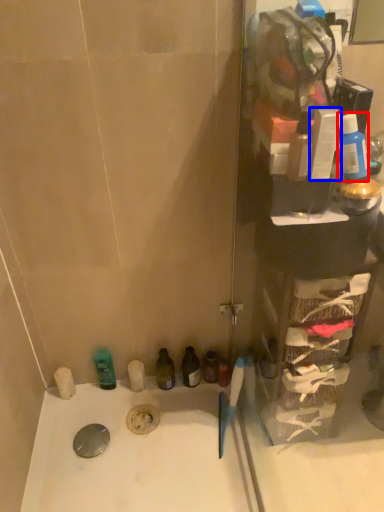
Question: Which object appears closest to the camera in this image, mouthwash (highlighted by a red box) or toiletry (highlighted by a blue box)?

Choices:
 (A) mouthwash
 (B) toiletry

Answer: (B)